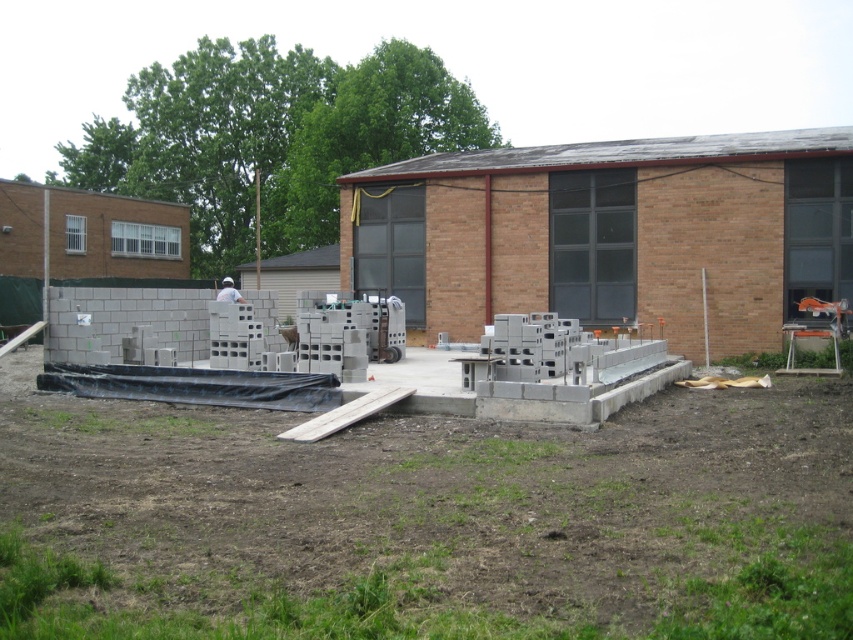
Question: Does gray concrete blocks at center appear on the left side of white matte construction worker at center?

Choices:
 (A) yes
 (B) no

Answer: (B)

Question: Can you confirm if gray concrete blocks at center is positioned below white matte construction worker at center?

Choices:
 (A) yes
 (B) no

Answer: (A)

Question: Does gray concrete blocks at center appear on the right side of white matte construction worker at center?

Choices:
 (A) yes
 (B) no

Answer: (A)